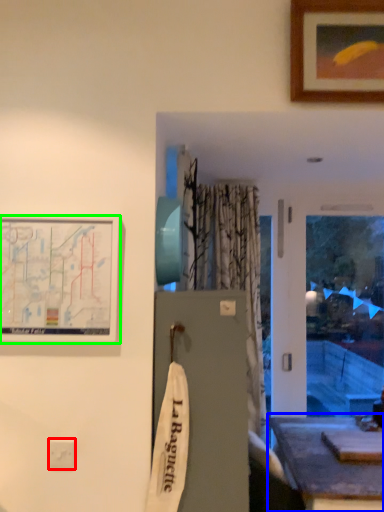
Question: Based on their relative distances, which object is farther from electric outlet (highlighted by a red box)? Choose from table (highlighted by a blue box) and picture frame (highlighted by a green box).

Choices:
 (A) table
 (B) picture frame

Answer: (A)